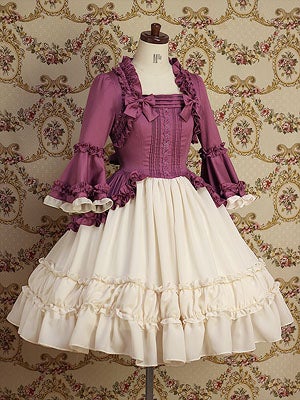
The width and height of the screenshot is (300, 400). I want to click on dressform, so click(156, 74).